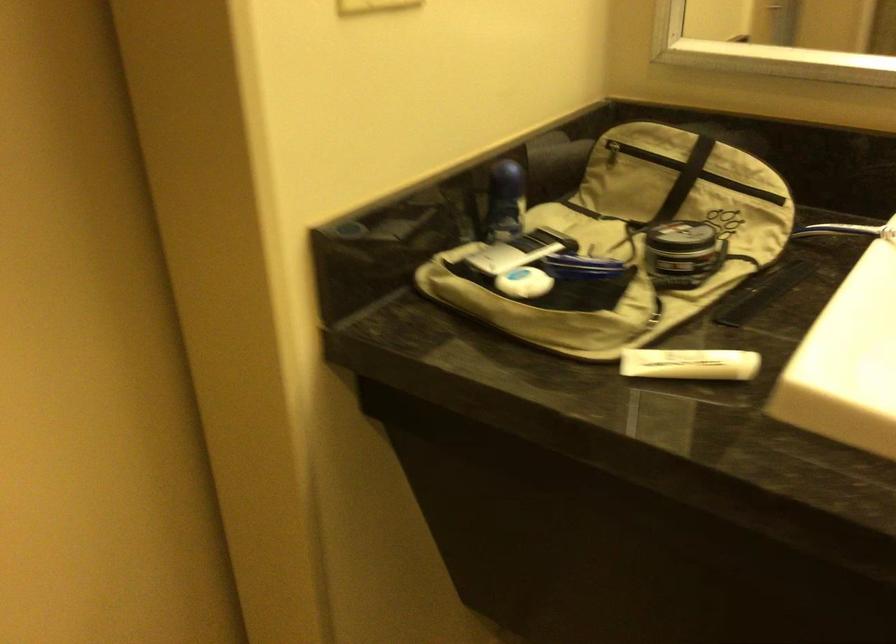
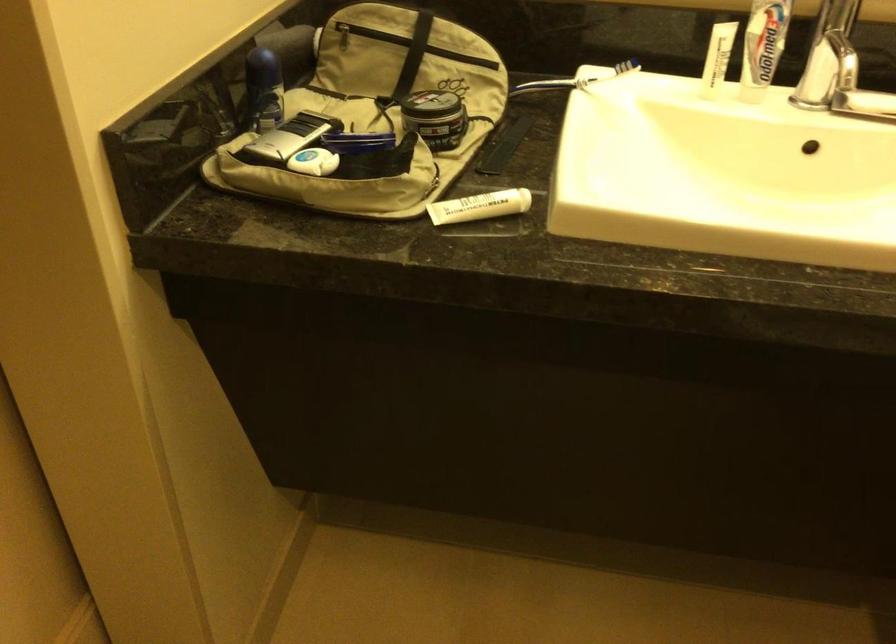
The point at (687, 365) is marked in the first image. Where is the corresponding point in the second image?

(479, 205)